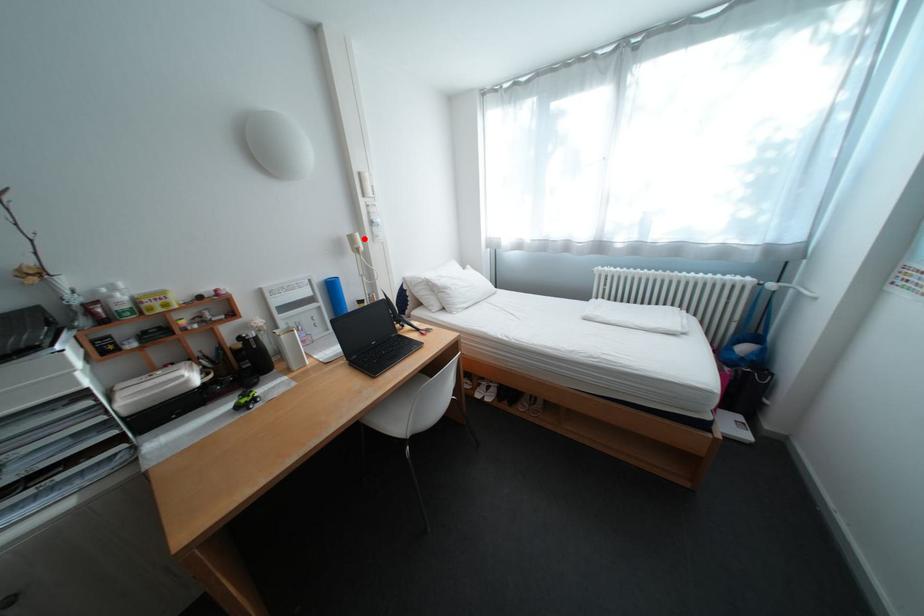
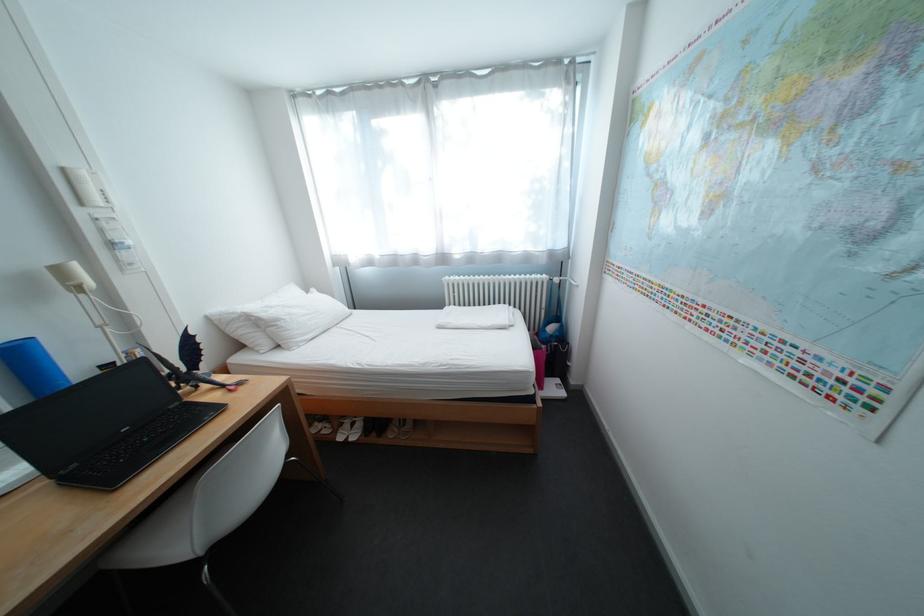
The point at the highlighted location is marked in the first image. Where is the corresponding point in the second image?

(71, 272)